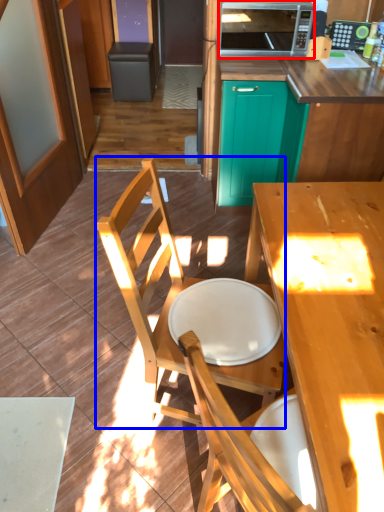
Question: Which of the following is the farthest to the observer, microwave oven (highlighted by a red box) or chair (highlighted by a blue box)?

Choices:
 (A) microwave oven
 (B) chair

Answer: (A)